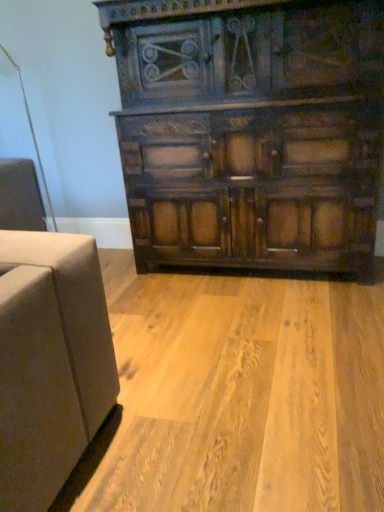
Question: Is natural wood floor at center not near dark wood cabinet at center?

Choices:
 (A) no
 (B) yes

Answer: (A)

Question: From a real-world perspective, is natural wood floor at center positioned over dark wood cabinet at center based on gravity?

Choices:
 (A) no
 (B) yes

Answer: (A)

Question: From a real-world perspective, is natural wood floor at center positioned under dark wood cabinet at center based on gravity?

Choices:
 (A) yes
 (B) no

Answer: (A)

Question: Is natural wood floor at center next to dark wood cabinet at center?

Choices:
 (A) no
 (B) yes

Answer: (A)

Question: Is dark wood cabinet at center inside natural wood floor at center?

Choices:
 (A) yes
 (B) no

Answer: (B)

Question: Considering the relative sizes of natural wood floor at center and dark wood cabinet at center in the image provided, is natural wood floor at center shorter than dark wood cabinet at center?

Choices:
 (A) no
 (B) yes

Answer: (B)

Question: Does dark wood cabinet at center have a larger size compared to natural wood floor at center?

Choices:
 (A) no
 (B) yes

Answer: (B)

Question: From a real-world perspective, is dark wood cabinet at center on natural wood floor at center?

Choices:
 (A) no
 (B) yes

Answer: (B)

Question: Is dark wood cabinet at center looking in the opposite direction of natural wood floor at center?

Choices:
 (A) yes
 (B) no

Answer: (B)

Question: Is dark wood cabinet at center at the left side of natural wood floor at center?

Choices:
 (A) yes
 (B) no

Answer: (B)

Question: Is dark wood cabinet at center shorter than natural wood floor at center?

Choices:
 (A) no
 (B) yes

Answer: (A)

Question: From the image's perspective, is dark wood cabinet at center under natural wood floor at center?

Choices:
 (A) yes
 (B) no

Answer: (B)

Question: From the image's perspective, is dark wood cabinet at center above or below natural wood floor at center?

Choices:
 (A) below
 (B) above

Answer: (B)